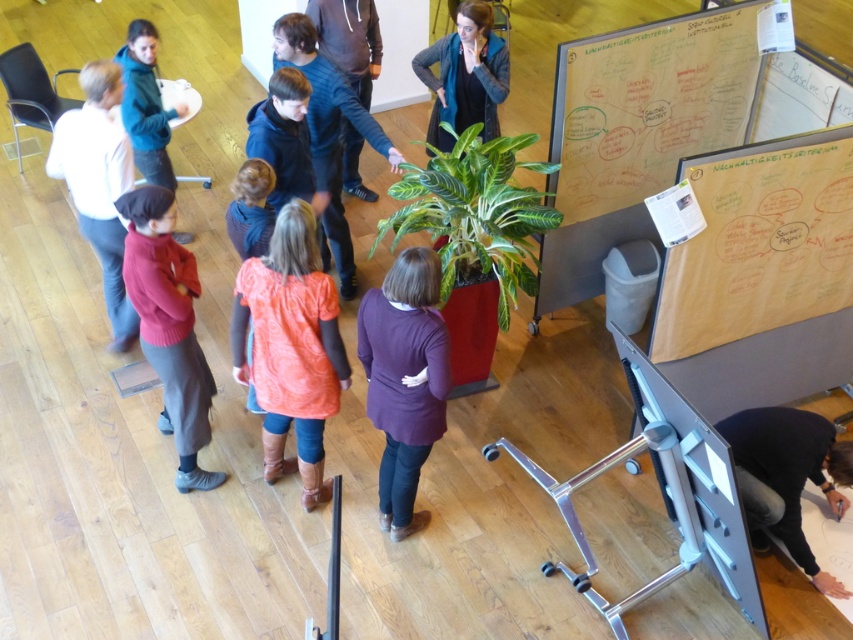
Describe the element at coordinates (291, 348) in the screenshot. The image size is (853, 640). I see `orange textured sweater at center` at that location.

Which is in front, point (264, 392) or point (416, 184)?

Point (264, 392)

I want to click on orange textured sweater at center, so (x=291, y=348).

Find the location of a particular element. This screenshot has height=640, width=853. dark blue sweater at center is located at coordinates (328, 138).

Which is behind, point (310, 150) or point (183, 106)?

The point (183, 106) is more distant.

Where is `dark blue sweater at center`? dark blue sweater at center is located at coordinates (328, 138).

This screenshot has height=640, width=853. In order to click on dark blue sweater at center in this screenshot , I will do `click(328, 138)`.

Is green glossy plant at center positioned before white cotton shirt at left?

Yes, green glossy plant at center is closer to the viewer.

Can you confirm if green glossy plant at center is smaller than white cotton shirt at left?

Incorrect, green glossy plant at center is not smaller in size than white cotton shirt at left.

Describe the element at coordinates (474, 212) in the screenshot. This screenshot has height=640, width=853. I see `green glossy plant at center` at that location.

I want to click on green glossy plant at center, so click(x=474, y=212).